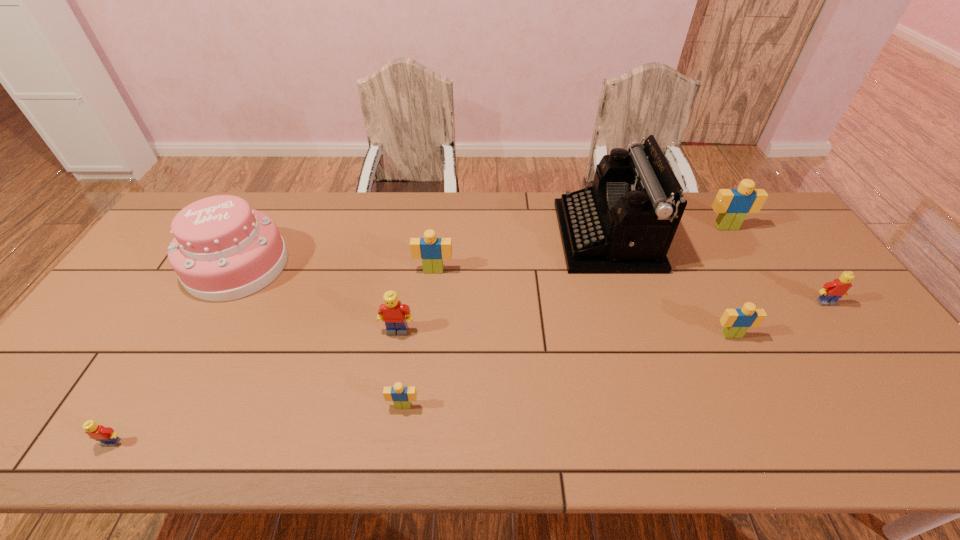
Choose which object is the nearest neighbor to the second farthest beige Lego. Please provide its 2D coordinates. Your answer should be formatted as a tuple, i.e. [(x, y)], where the tuple contains the x and y coordinates of a point satisfying the conditions above.

[(392, 313)]

Find the location of `the sixth closest Lego relative to the sixth farthest Lego`. the sixth closest Lego relative to the sixth farthest Lego is located at coordinates (832, 291).

Find the location of a particular element. The width and height of the screenshot is (960, 540). the second closest Lego to the birthday cake is located at coordinates (432, 250).

I want to click on beige Lego object that ranks as the closest to the black typewriter, so click(x=732, y=205).

Identify which beige Lego is the second nearest to the farthest yellow Lego. Please provide its 2D coordinates. Your answer should be formatted as a tuple, i.e. [(x, y)], where the tuple contains the x and y coordinates of a point satisfying the conditions above.

[(732, 205)]

The width and height of the screenshot is (960, 540). I want to click on yellow Lego that is the second closest to the pink birthday cake, so 106,435.

Point out which yellow Lego is positioned as the third nearest to the second farthest Lego. Please provide its 2D coordinates. Your answer should be formatted as a tuple, i.e. [(x, y)], where the tuple contains the x and y coordinates of a point satisfying the conditions above.

[(832, 291)]

The image size is (960, 540). Find the location of `free space that satisfies the following two spatial constraints: 1. on the typing side of the tallest object; 2. on the face of the smallest beige Lego`. free space that satisfies the following two spatial constraints: 1. on the typing side of the tallest object; 2. on the face of the smallest beige Lego is located at coordinates (659, 406).

This screenshot has width=960, height=540. What are the coordinates of `vacant region that satisfies the following two spatial constraints: 1. on the typing side of the tallest object; 2. on the front-facing side of the nearest yellow Lego` in the screenshot? It's located at (670, 442).

This screenshot has height=540, width=960. In order to click on vacant position in the image that satisfies the following two spatial constraints: 1. on the typing side of the typewriter; 2. on the front-facing side of the nearest object in this screenshot , I will do `click(670, 442)`.